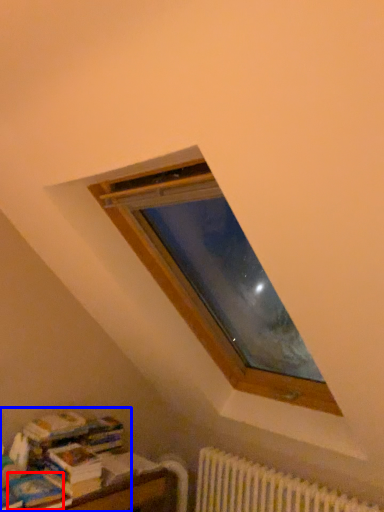
Question: Which point is further to the camera, paperback book (highlighted by a red box) or book (highlighted by a blue box)?

Choices:
 (A) paperback book
 (B) book

Answer: (B)